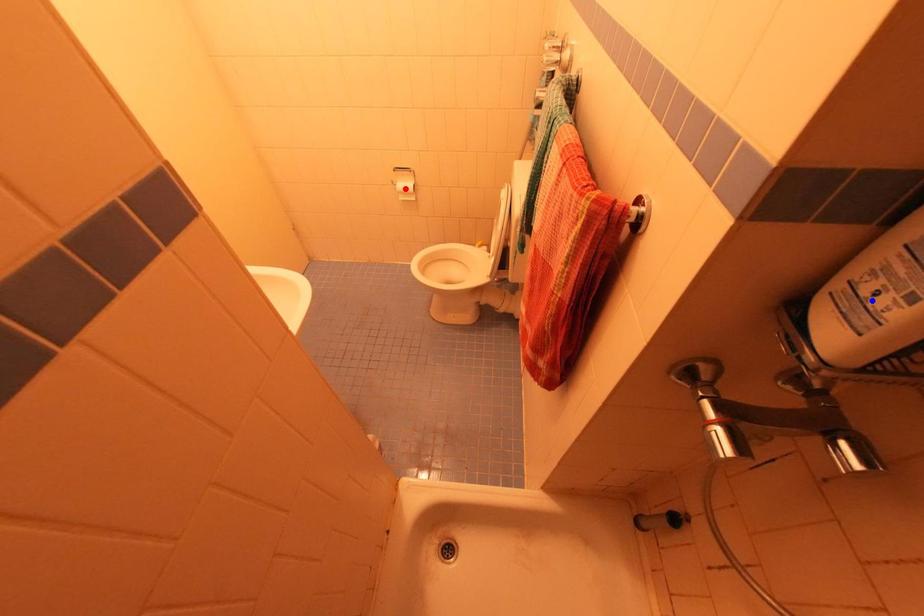
Question: Which of the two points in the image is closer to the camera?

Choices:
 (A) Blue point is closer.
 (B) Red point is closer.

Answer: (A)